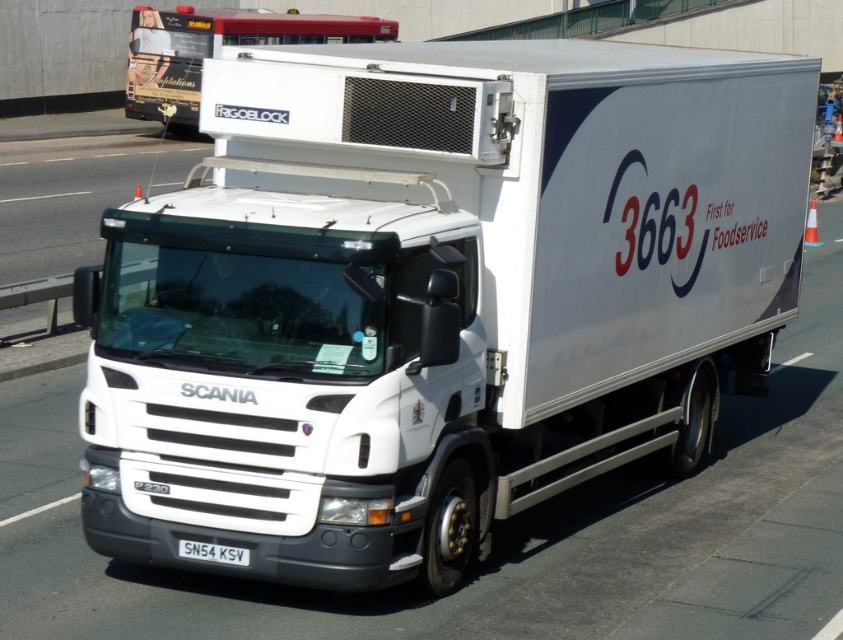
Measure the distance between point (269, 13) and camera.

They are 34.08 meters apart.

Between white matte truck at upper center and white plastic license plate at lower center, which one has less height?

Standing shorter between the two is white plastic license plate at lower center.

This screenshot has width=843, height=640. What do you see at coordinates (215, 51) in the screenshot?
I see `white matte truck at upper center` at bounding box center [215, 51].

I want to click on white matte truck at upper center, so click(215, 51).